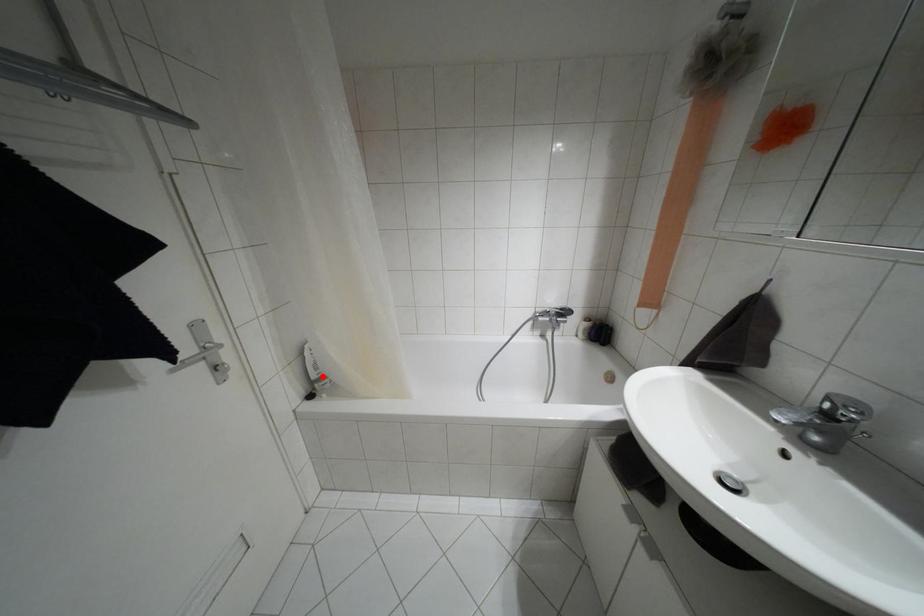
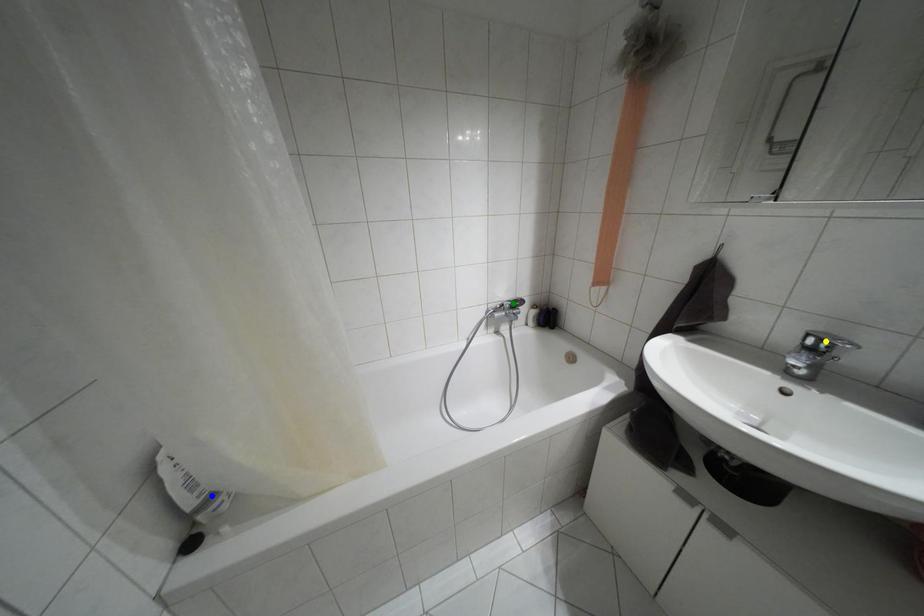
Question: I am providing you with two images of the same scene from different viewpoints. A red point is marked on the first image. You are given multiple points on the second image. Which spot in image 2 lines up with the point in image 1?

Choices:
 (A) blue point
 (B) yellow point
 (C) green point

Answer: (A)